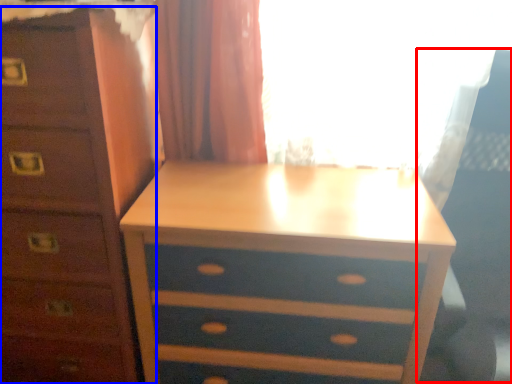
Question: Which point is closer to the camera, swivel chair (highlighted by a red box) or chest of drawers (highlighted by a blue box)?

Choices:
 (A) swivel chair
 (B) chest of drawers

Answer: (A)